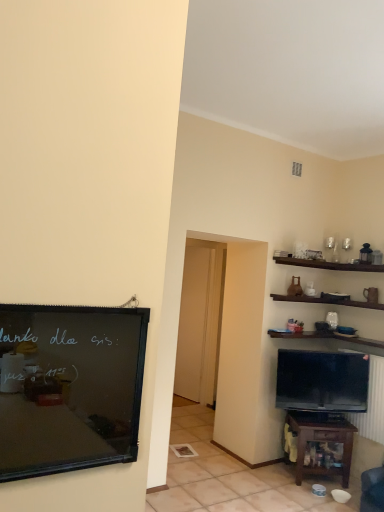
Describe the element at coordinates (322, 381) in the screenshot. The width and height of the screenshot is (384, 512). I see `matte black tv at lower right` at that location.

This screenshot has width=384, height=512. Identify the location of matte black tv at lower right. (322, 381).

I want to click on brown wooden table at lower right, so click(x=322, y=444).

The width and height of the screenshot is (384, 512). What are the coordinates of `transparent glass door at center` in the screenshot? It's located at (200, 321).

Can you confirm if black matte bulletin board at left is taller than brown wooden table at lower right?

No, black matte bulletin board at left is not taller than brown wooden table at lower right.

From the image's perspective, which is below, black matte bulletin board at left or brown wooden table at lower right?

brown wooden table at lower right, from the image's perspective.

Can you confirm if black matte bulletin board at left is smaller than brown wooden table at lower right?

Correct, black matte bulletin board at left occupies less space than brown wooden table at lower right.

Is point (131, 361) farther from viewer compared to point (303, 413)?

No.

Locate an element on the screen. The width and height of the screenshot is (384, 512). glass door above the matte black tv at lower right (from a real-world perspective) is located at coordinates (200, 321).

Looking at this image, from a real-world perspective, relative to transparent glass door at center, is matte black tv at lower right vertically above or below?

From a real-world perspective, matte black tv at lower right is physically below transparent glass door at center.

Is matte black tv at lower right inside the boundaries of transparent glass door at center, or outside?

matte black tv at lower right is located beyond the bounds of transparent glass door at center.

Which of these two, matte black tv at lower right or transparent glass door at center, is wider?

matte black tv at lower right is wider.

Considering the positions of objects black matte bulletin board at left and transparent glass door at center in the image provided, who is in front, black matte bulletin board at left or transparent glass door at center?

black matte bulletin board at left is more forward.

How much distance is there between black matte bulletin board at left and transparent glass door at center?

black matte bulletin board at left is 4.42 meters from transparent glass door at center.

Is black matte bulletin board at left facing towards transparent glass door at center?

No, black matte bulletin board at left is not turned towards transparent glass door at center.

Are black matte bulletin board at left and transparent glass door at center beside each other?

No, black matte bulletin board at left is not touching transparent glass door at center.

From the image's perspective, relative to brown wooden table at lower right, is transparent glass door at center above or below?

transparent glass door at center is situated higher than brown wooden table at lower right in the image.

From a real-world perspective, relative to brown wooden table at lower right, is transparent glass door at center vertically above or below?

From a real-world perspective, transparent glass door at center is physically above brown wooden table at lower right.

Is transparent glass door at center positioned far away from brown wooden table at lower right?

Yes, transparent glass door at center is far from brown wooden table at lower right.

Could you tell me if transparent glass door at center is turned towards brown wooden table at lower right?

Yes, transparent glass door at center is oriented towards brown wooden table at lower right.

Could brown wooden table at lower right be considered to be inside matte black tv at lower right?

No, brown wooden table at lower right is not inside matte black tv at lower right.

Is point (306, 364) closer to viewer compared to point (310, 428)?

That is False.

Based on the photo, can you confirm if matte black tv at lower right is taller than brown wooden table at lower right?

Correct, matte black tv at lower right is much taller as brown wooden table at lower right.

Looking at this image, from the image's perspective, between black matte bulletin board at left and matte black tv at lower right, which one is located above?

black matte bulletin board at left appears higher in the image.

Between black matte bulletin board at left and matte black tv at lower right, which one has smaller size?

black matte bulletin board at left is smaller.

Considering the sizes of black matte bulletin board at left and matte black tv at lower right in the image, is black matte bulletin board at left taller or shorter than matte black tv at lower right?

Considering their sizes, black matte bulletin board at left has less height than matte black tv at lower right.

Considering the positions of objects black matte bulletin board at left and matte black tv at lower right in the image provided, who is in front, black matte bulletin board at left or matte black tv at lower right?

Positioned in front is black matte bulletin board at left.

Looking at this image, how many degrees apart are the facing directions of transparent glass door at center and matte black tv at lower right?

29 degrees.

Is transparent glass door at center inside the boundaries of matte black tv at lower right, or outside?

transparent glass door at center is located beyond the bounds of matte black tv at lower right.

From a real-world perspective, is transparent glass door at center positioned above or below matte black tv at lower right?

Clearly, from a real-world perspective, transparent glass door at center is above matte black tv at lower right.

Locate an element on the screen. television below the transparent glass door at center (from a real-world perspective) is located at coordinates (322, 381).

The image size is (384, 512). I want to click on table located on the right of black matte bulletin board at left, so click(x=322, y=444).

This screenshot has height=512, width=384. Identify the location of television beneath the transparent glass door at center (from a real-world perspective). (322, 381).

Estimate the real-world distances between objects in this image. Which object is closer to matte black tv at lower right, brown wooden table at lower right or transparent glass door at center?

Among the two, brown wooden table at lower right is located nearer to matte black tv at lower right.

Consider the image. Based on their spatial positions, is transparent glass door at center or black matte bulletin board at left further from brown wooden table at lower right?

The object further to brown wooden table at lower right is black matte bulletin board at left.

From the image, which object appears to be farther from brown wooden table at lower right, matte black tv at lower right or transparent glass door at center?

transparent glass door at center is further to brown wooden table at lower right.

Considering their positions, is transparent glass door at center positioned further to matte black tv at lower right than black matte bulletin board at left?

Based on the image, black matte bulletin board at left appears to be further to matte black tv at lower right.

Looking at the image, which one is located closer to brown wooden table at lower right, transparent glass door at center or matte black tv at lower right?

matte black tv at lower right.

Which object lies further to the anchor point black matte bulletin board at left, matte black tv at lower right or brown wooden table at lower right?

matte black tv at lower right is further to black matte bulletin board at left.

Which object lies nearer to the anchor point transparent glass door at center, black matte bulletin board at left or matte black tv at lower right?

matte black tv at lower right is closer to transparent glass door at center.

Looking at the image, which one is located further to black matte bulletin board at left, matte black tv at lower right or transparent glass door at center?

transparent glass door at center lies further to black matte bulletin board at left than the other object.

At what (x,y) coordinates should I click in order to perform the action: click on television located between brown wooden table at lower right and transparent glass door at center in the depth direction. Please return your answer as a coordinate pair (x, y). The width and height of the screenshot is (384, 512). Looking at the image, I should click on (322, 381).

At what (x,y) coordinates should I click in order to perform the action: click on table between black matte bulletin board at left and transparent glass door at center from front to back. Please return your answer as a coordinate pair (x, y). The height and width of the screenshot is (512, 384). Looking at the image, I should click on (322, 444).

Locate an element on the screen. table located between black matte bulletin board at left and matte black tv at lower right in the depth direction is located at coordinates (322, 444).

At what (x,y) coordinates should I click in order to perform the action: click on television between black matte bulletin board at left and transparent glass door at center from front to back. Please return your answer as a coordinate pair (x, y). The width and height of the screenshot is (384, 512). Looking at the image, I should click on (322, 381).